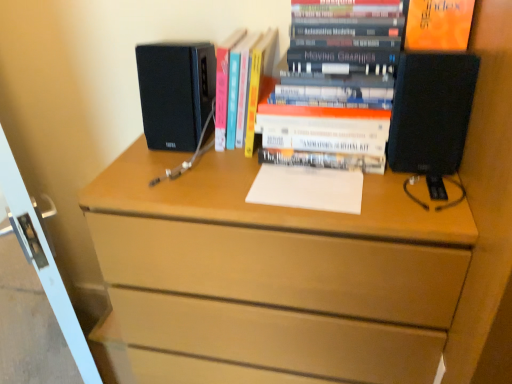
Locate an element on the screen. This screenshot has height=384, width=512. vacant region to the left of hardcover books at center, which appears as the 2th book when viewed from the left is located at coordinates (202, 170).